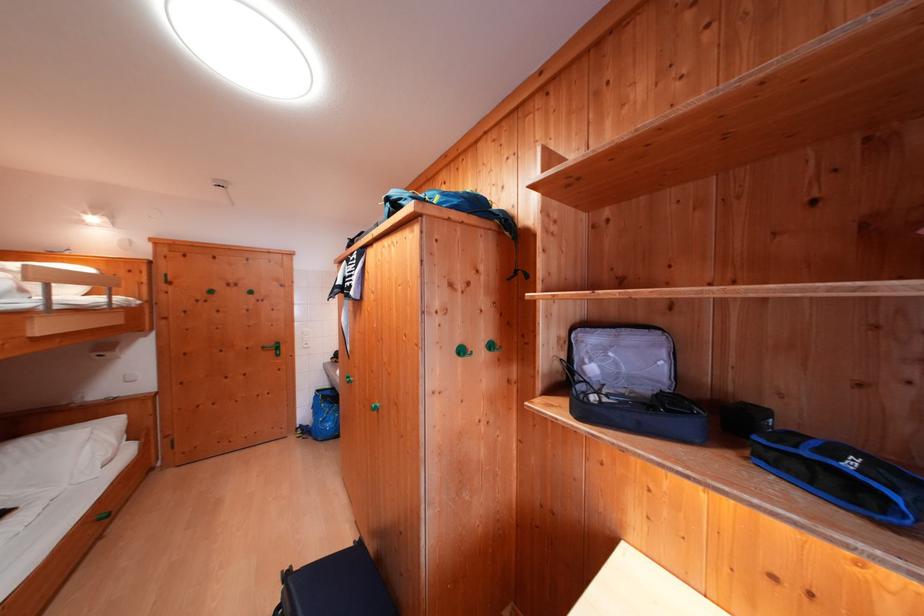
What do you see at coordinates (273, 347) in the screenshot? This screenshot has width=924, height=616. I see `the green door handle` at bounding box center [273, 347].